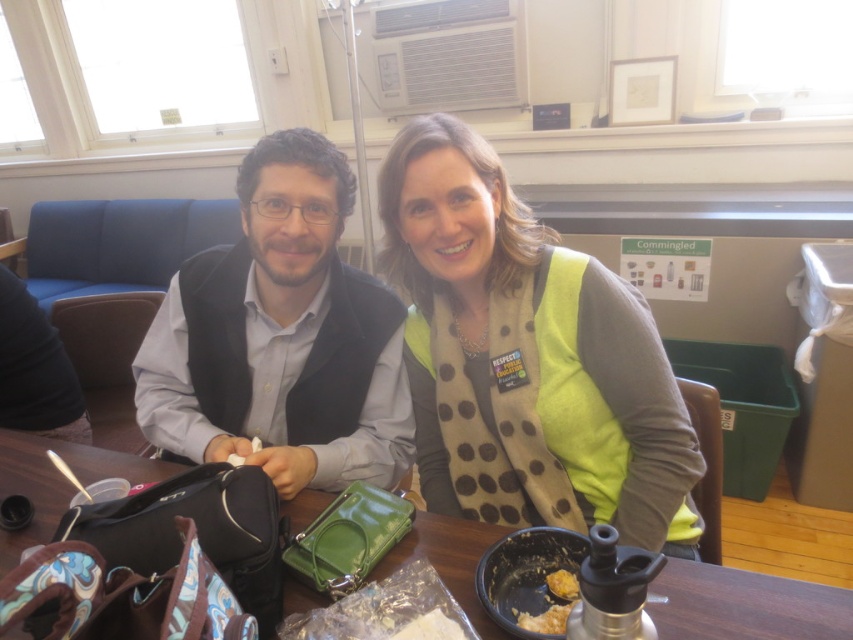
Between green polka dot scarf at center and yellowish crumbly food at lower center, which one has more height?

green polka dot scarf at center

Who is higher up, green polka dot scarf at center or yellowish crumbly food at lower center?

green polka dot scarf at center is higher up.

Identify the location of green polka dot scarf at center. (527, 356).

Find the location of a particular element. Image resolution: width=853 pixels, height=640 pixels. green polka dot scarf at center is located at coordinates 527,356.

Describe the element at coordinates (527, 356) in the screenshot. Image resolution: width=853 pixels, height=640 pixels. I see `green polka dot scarf at center` at that location.

Does point (460, 435) lie behind point (369, 465)?

No, (460, 435) is in front of (369, 465).

Locate an element on the screen. Image resolution: width=853 pixels, height=640 pixels. green polka dot scarf at center is located at coordinates (527, 356).

Between matte black vest at center and yellowish crumbly food at lower center, which one has more height?

Standing taller between the two is matte black vest at center.

Which is above, matte black vest at center or yellowish crumbly food at lower center?

matte black vest at center is above.

Locate an element on the screen. This screenshot has width=853, height=640. matte black vest at center is located at coordinates (281, 337).